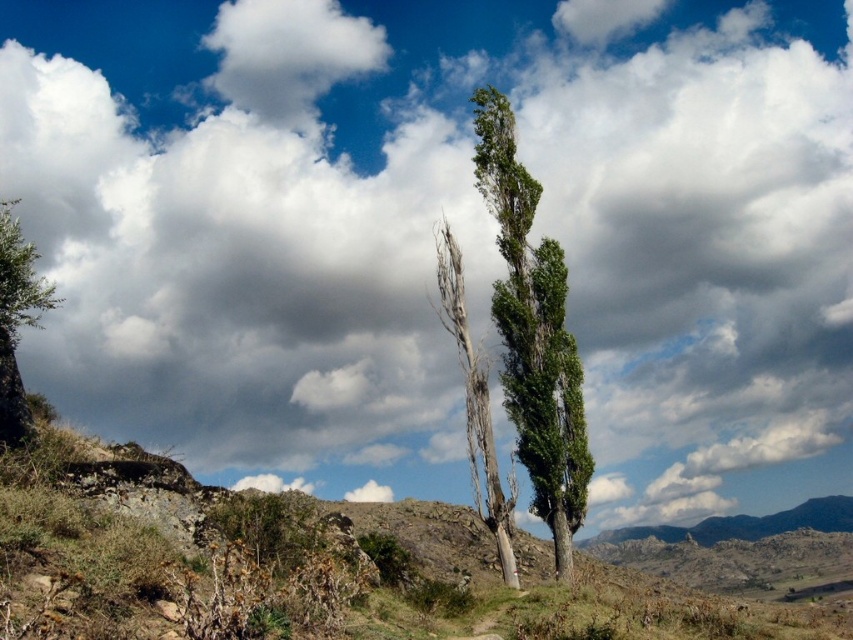
You are standing in the rugged terrain looking at the two green leafy trees. Which tree is closer to you, the green leafy tree at center or the green leafy tree at left?

The green leafy tree at center is closer to you because the green leafy tree at left is behind it.